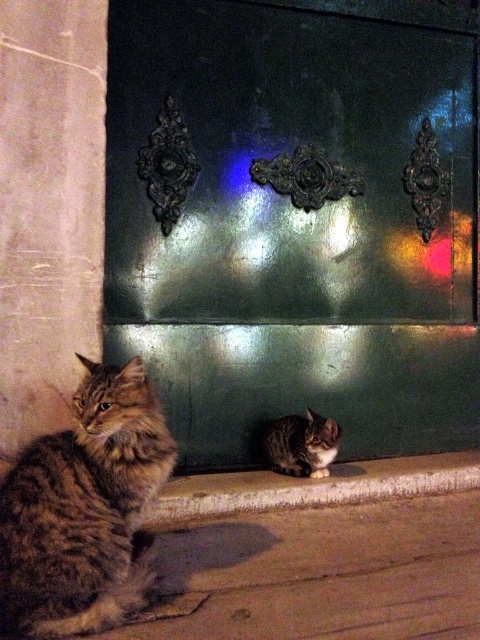
Who is positioned more to the left, tabby fur cat at left or tabby fur cat at lower center?

Positioned to the left is tabby fur cat at left.

Between point (0, 547) and point (297, 428), which one is positioned behind?

Point (297, 428)

At what (x,y) coordinates should I click in order to perform the action: click on tabby fur cat at left. Please return your answer as a coordinate pair (x, y). Looking at the image, I should click on (84, 509).

Who is higher up, tabby fur cat at left or smooth concrete ledge at lower center?

tabby fur cat at left

Is tabby fur cat at left shorter than smooth concrete ledge at lower center?

Incorrect, tabby fur cat at left's height does not fall short of smooth concrete ledge at lower center's.

Find the location of a particular element. tabby fur cat at left is located at coordinates (84, 509).

Between smooth concrete ledge at lower center and tabby fur cat at lower center, which one is positioned lower?

smooth concrete ledge at lower center

Which is above, smooth concrete ledge at lower center or tabby fur cat at lower center?

tabby fur cat at lower center

Find the location of a particular element. smooth concrete ledge at lower center is located at coordinates (312, 486).